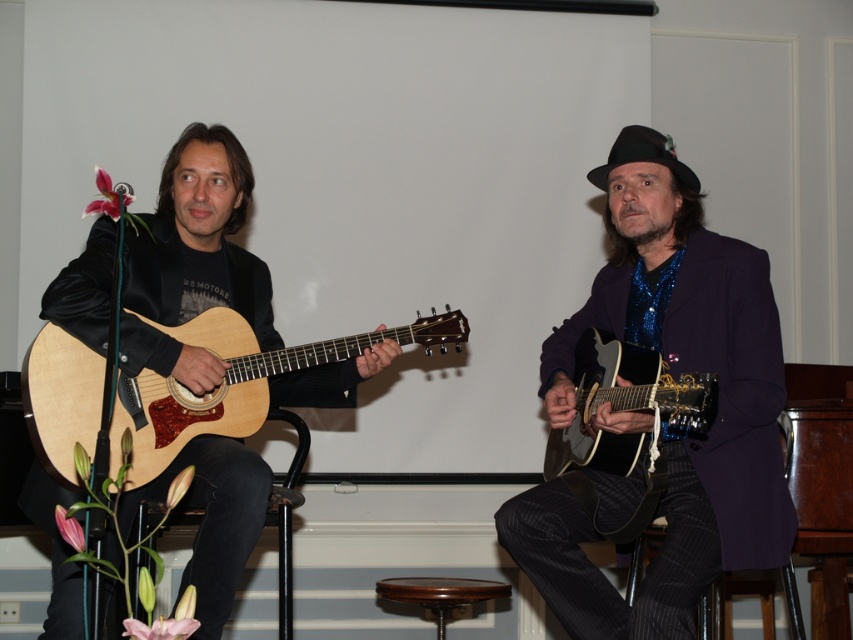
You are a photographer setting up a shoot. You need to position a camera on a tripod so that both the matte black guitar at left and the mahogany wood bar stool at center are in frame. Given their height difference, which object will require you to adjust the camera angle upwards more to capture properly?

The matte black guitar at left is much taller than the mahogany wood bar stool at center, so you will need to adjust the camera angle upwards more to capture the matte black guitar at left properly.

You are a photographer setting up for a live performance. You need to position a camera tripod between the two guitars to capture both in the frame. Given that the matte black guitar at left is taller than the natural wood acoustic guitar at left, which guitar should you place closer to the camera to ensure the taller one doesn

You should position the matte black guitar at left closer to the camera since it is taller than the natural wood acoustic guitar at left. This placement will help ensure both guitars are fully visible in the frame without the taller one being cropped out.